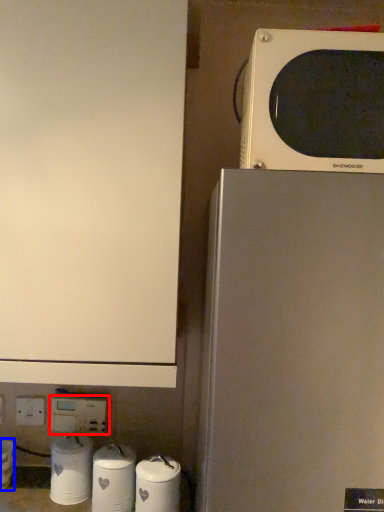
Question: Which object is further to the camera taking this photo, electric outlet (highlighted by a red box) or appliance (highlighted by a blue box)?

Choices:
 (A) electric outlet
 (B) appliance

Answer: (A)